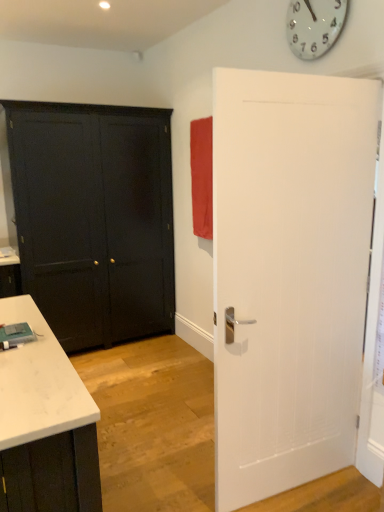
Question: In terms of size, does matte red curtain at upper right appear bigger or smaller than matte black door at left, the 2th door from the right?

Choices:
 (A) big
 (B) small

Answer: (B)

Question: From the image's perspective, is matte red curtain at upper right positioned above or below matte black door at left, the first door positioned from the back?

Choices:
 (A) above
 (B) below

Answer: (A)

Question: Considering the real-world distances, which object is closest to the matte red curtain at upper right?

Choices:
 (A) matte black door at left, the first door positioned from the back
 (B) white glossy clock at upper center
 (C) white textured door at right, the second door positioned from the back

Answer: (A)

Question: Estimate the real-world distances between objects in this image. Which object is closer to the white glossy clock at upper center?

Choices:
 (A) matte black door at left, the 2th door from the right
 (B) matte red curtain at upper right
 (C) white textured door at right, which ranks as the 1th door in front-to-back order

Answer: (C)